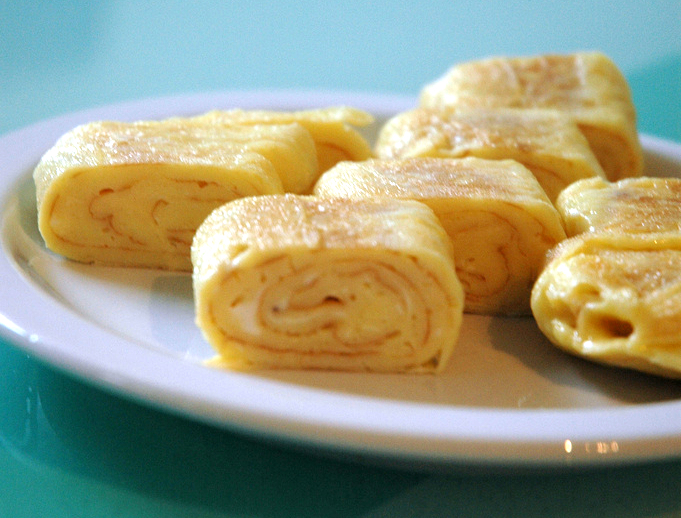
Image resolution: width=681 pixels, height=518 pixels. Find the location of `table`. table is located at coordinates (104, 470).